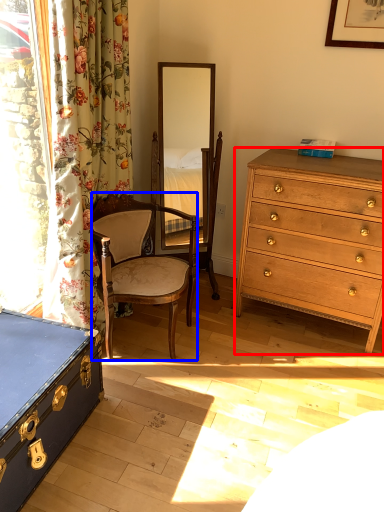
Question: Which point is further to the camera, chest of drawers (highlighted by a red box) or chair (highlighted by a blue box)?

Choices:
 (A) chest of drawers
 (B) chair

Answer: (A)